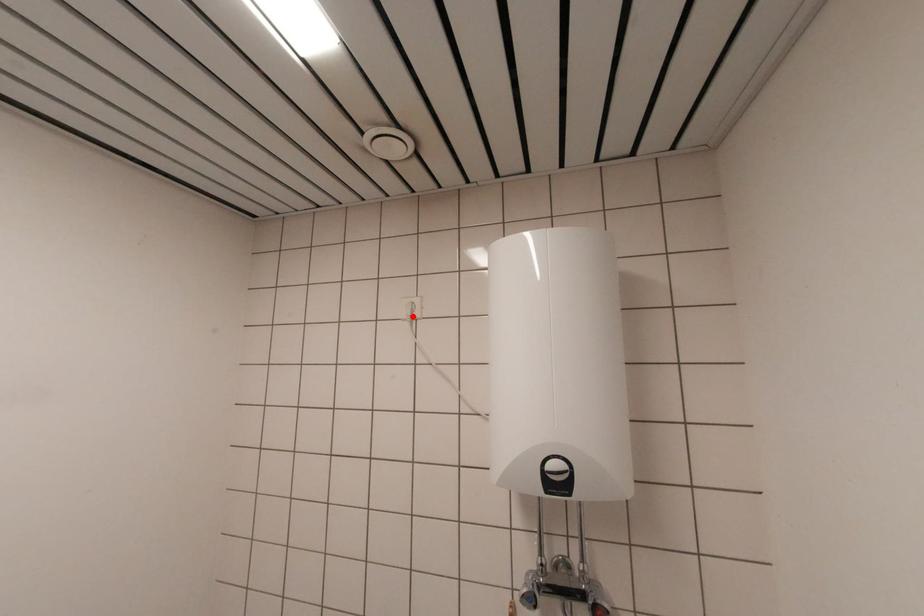
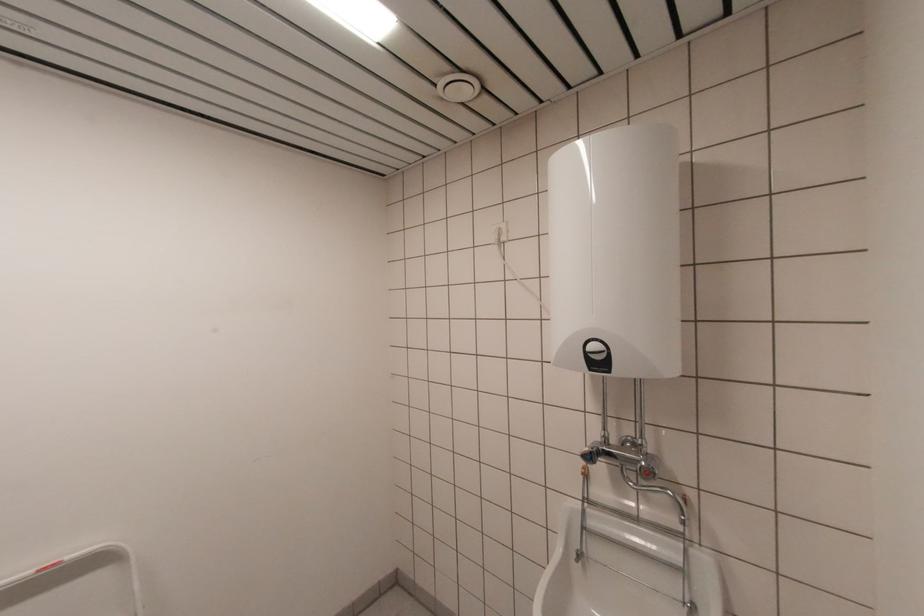
Find the pixel in the second image that matches the highlighted location in the first image.

(501, 240)